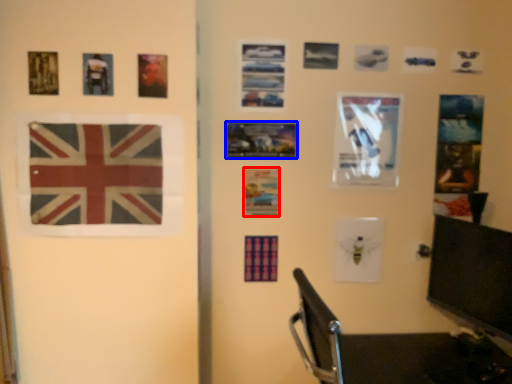
Question: Which of the following is the farthest to the observer, postcard (highlighted by a red box) or picture frame (highlighted by a blue box)?

Choices:
 (A) postcard
 (B) picture frame

Answer: (A)